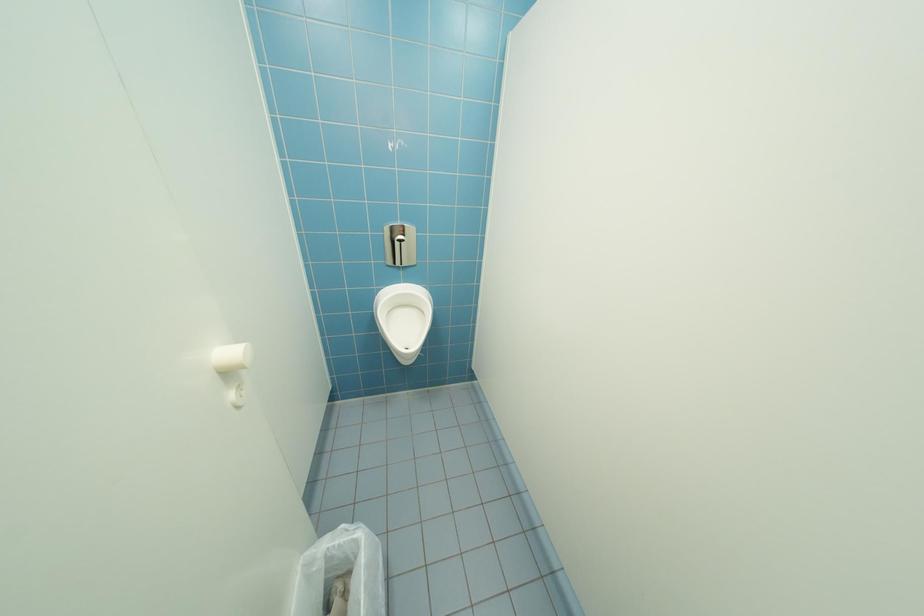
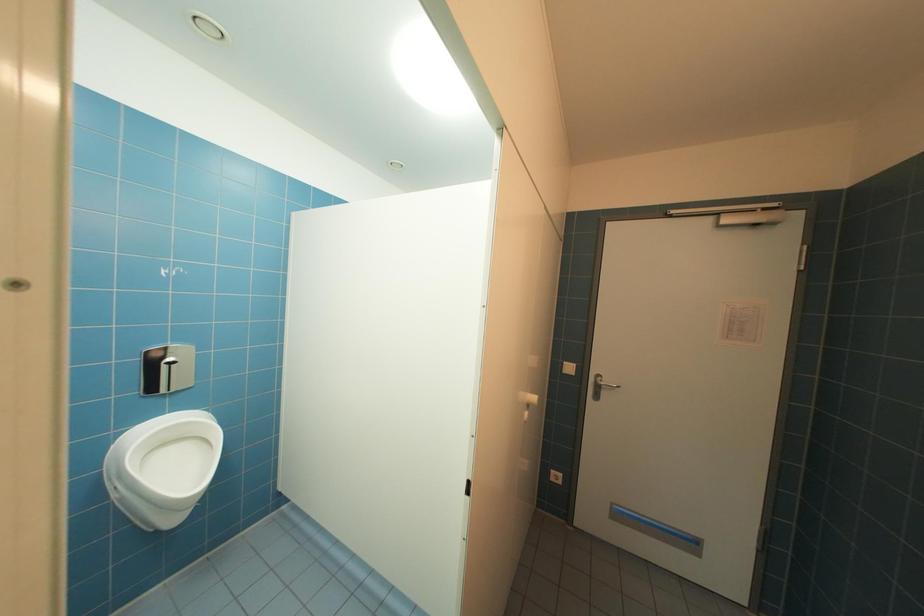
Question: The camera is either moving clockwise (left) or counter-clockwise (right) around the object. The first image is from the beginning of the video and the second image is from the end. Is the camera moving left or right when shooting the video?

Choices:
 (A) Left
 (B) Right

Answer: (A)